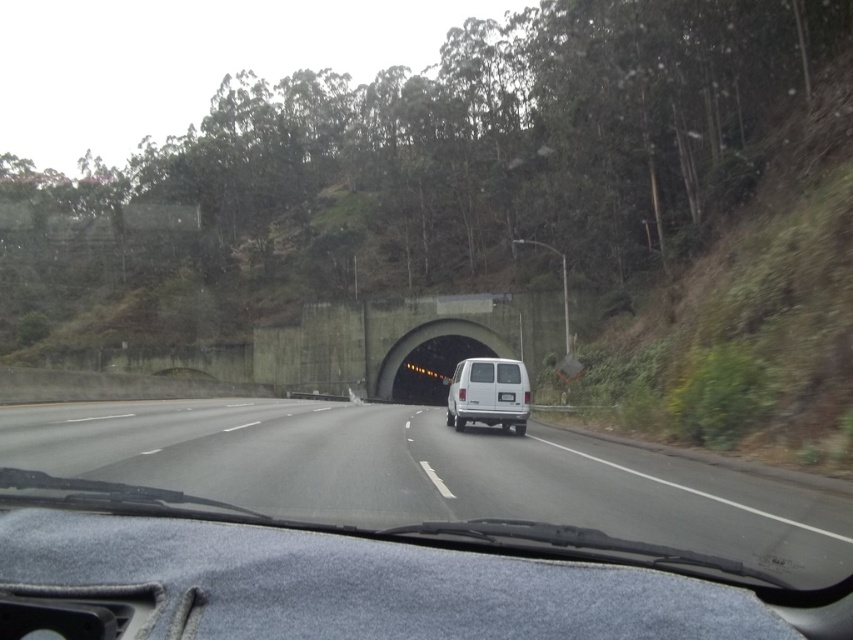
Question: Does smooth asphalt highway at center have a larger size compared to concrete tunnel at center?

Choices:
 (A) no
 (B) yes

Answer: (B)

Question: Does smooth asphalt highway at center have a smaller size compared to white matte van at center?

Choices:
 (A) no
 (B) yes

Answer: (A)

Question: Which point is closer to the camera?

Choices:
 (A) (479, 339)
 (B) (625, 518)

Answer: (B)

Question: Can you confirm if smooth asphalt highway at center is positioned to the left of white matte van at center?

Choices:
 (A) no
 (B) yes

Answer: (B)

Question: Which object is the closest to the concrete tunnel at center?

Choices:
 (A) smooth asphalt highway at center
 (B) white matte van at center

Answer: (B)

Question: Which object is positioned closest to the white matte van at center?

Choices:
 (A) concrete tunnel at center
 (B) smooth asphalt highway at center

Answer: (B)